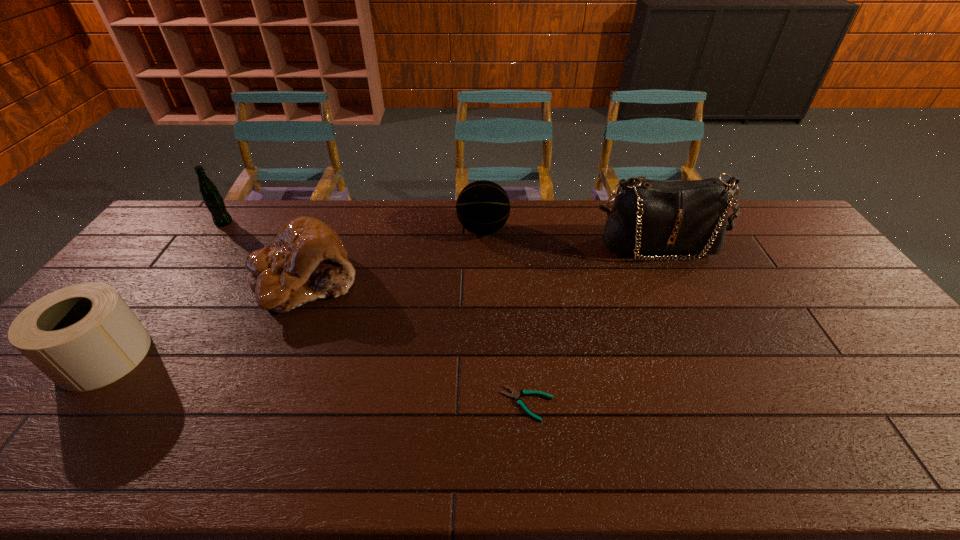
This screenshot has height=540, width=960. In order to click on handbag in this screenshot , I will do `click(648, 216)`.

Locate an element on the screen. This screenshot has height=540, width=960. the tallest object is located at coordinates (648, 216).

At what (x,y) coordinates should I click in order to perform the action: click on beer bottle. Please return your answer as a coordinate pair (x, y). The height and width of the screenshot is (540, 960). Looking at the image, I should click on (212, 198).

Image resolution: width=960 pixels, height=540 pixels. What are the coordinates of `basketball` in the screenshot? It's located at pos(483,207).

At what (x,y) coordinates should I click in order to perform the action: click on bread. Please return your answer as a coordinate pair (x, y). Looking at the image, I should click on (307, 261).

Find the location of a particular element. This screenshot has width=960, height=540. toilet tissue is located at coordinates (82, 337).

You are a GUI agent. You are given a task and a screenshot of the screen. Output one action in this format:
    pyautogui.click(x=<x>, y=<y>)
    Task: Click on the shortest object
    This screenshot has height=540, width=960.
    Given the screenshot: What is the action you would take?
    pyautogui.click(x=515, y=394)

At what (x,y) coordinates should I click in order to perform the action: click on free point located 0.310m at the front of the rightmost object with chain and zipper. Please return your answer as a coordinate pair (x, y). The height and width of the screenshot is (540, 960). Looking at the image, I should click on click(x=701, y=342).

The width and height of the screenshot is (960, 540). In order to click on vacant area situated 0.240m on the front of the second tallest object in this screenshot , I will do `click(187, 274)`.

Locate an element on the screen. vacant region located 0.050m on the back of the basketball is located at coordinates (483, 207).